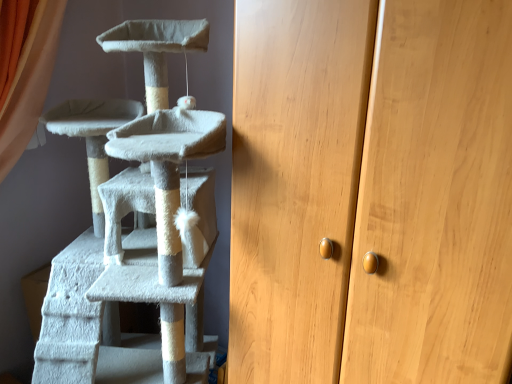
The width and height of the screenshot is (512, 384). Describe the element at coordinates (138, 233) in the screenshot. I see `white felt cat tree at left` at that location.

Where is `white felt cat tree at left`? The width and height of the screenshot is (512, 384). white felt cat tree at left is located at coordinates (138, 233).

Locate an element on the screen. white felt cat tree at left is located at coordinates point(138,233).